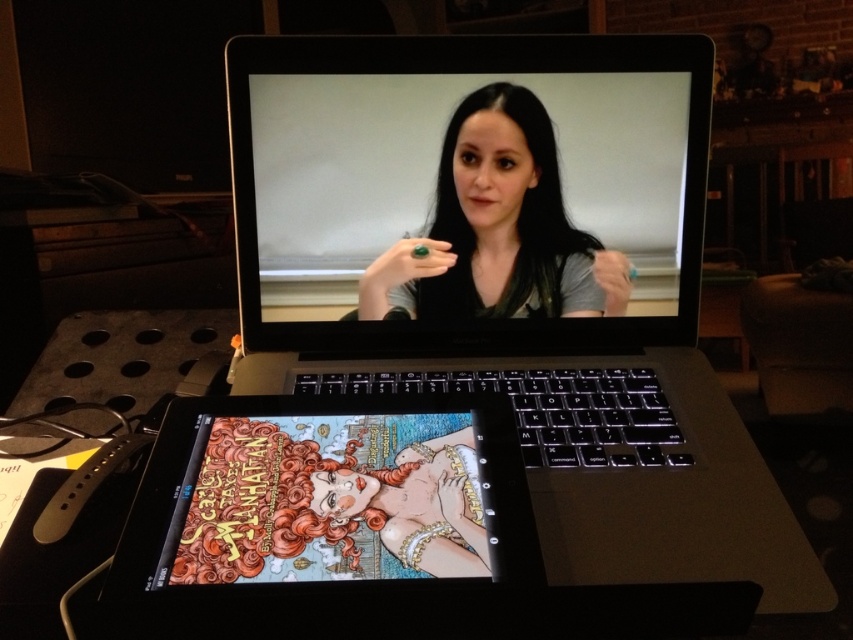
In the scene shown: You are organizing a tech showcase and need to place the satin black laptop at center and the matte black ring at center on a display table. Given their sizes, which object will require more space on the table?

The satin black laptop at center is larger in size than the matte black ring at center, so it will require more space on the table.

What object is located at the coordinate point (526, 292) in the image?

The point (526, 292) corresponds to the sleek silver laptop at center.

You are organizing a tech conference and need to ensure that all devices are properly positioned. According to the image, where is the satin black laptop at center in relation to the matte black ring at center?

The satin black laptop at center is above the matte black ring at center.